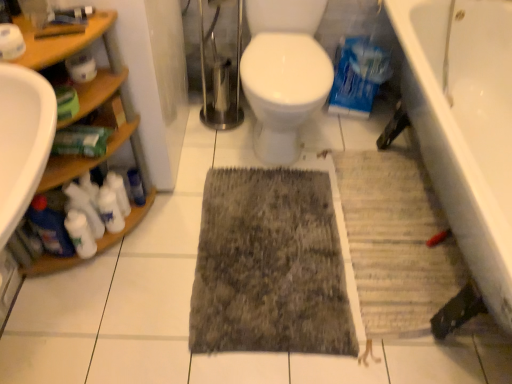
Where is `free space in front of blue plastic bottle at left`? The height and width of the screenshot is (384, 512). free space in front of blue plastic bottle at left is located at coordinates (141, 244).